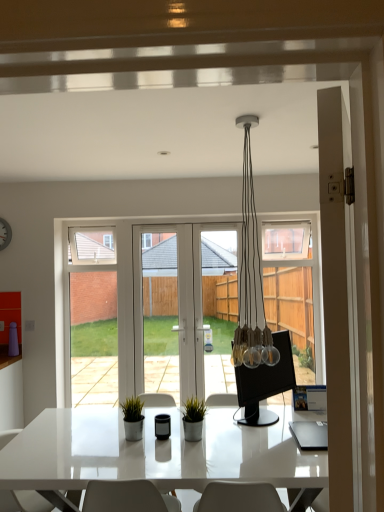
The height and width of the screenshot is (512, 384). In order to click on free space in front of green matte plant at center in this screenshot , I will do `click(191, 451)`.